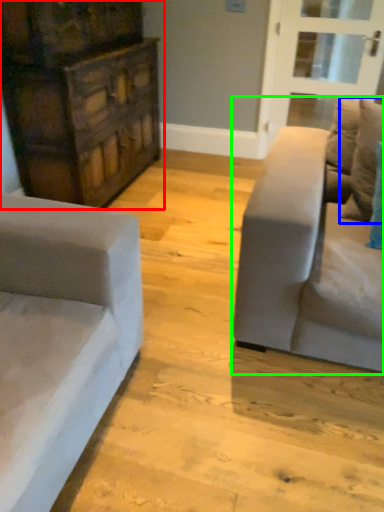
Question: Which object is the closest to the dresser (highlighted by a red box)? Choose among these: pillow (highlighted by a blue box) or studio couch (highlighted by a green box).

Choices:
 (A) pillow
 (B) studio couch

Answer: (B)